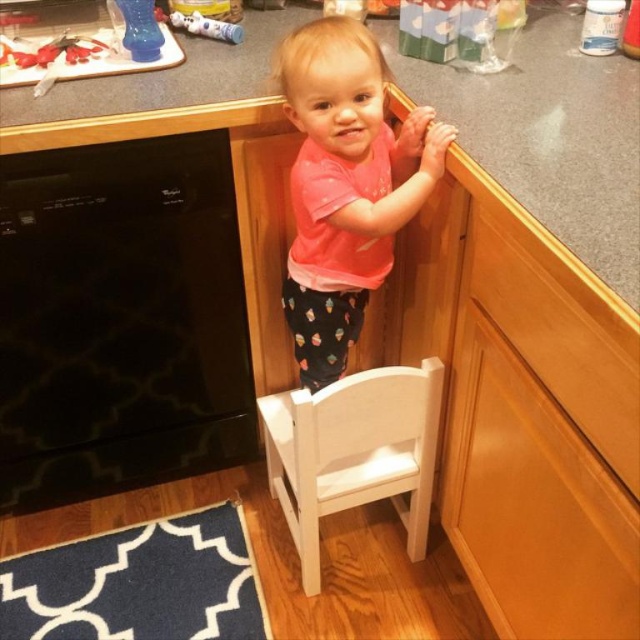
Question: From the image, what is the correct spatial relationship of black glossy oven at left in relation to wooden drawer at upper right?

Choices:
 (A) below
 (B) above

Answer: (A)

Question: Which of the following is the closest to the observer?

Choices:
 (A) (390, 234)
 (B) (177, 24)

Answer: (A)

Question: Is pink matte shirt at center further to camera compared to wooden drawer at upper right?

Choices:
 (A) no
 (B) yes

Answer: (B)

Question: Which object is closer to the camera taking this photo?

Choices:
 (A) wooden drawer at upper right
 (B) white wooden chair at lower center

Answer: (A)

Question: Can you confirm if gray matte counter top at upper center is bigger than white wooden chair at lower center?

Choices:
 (A) yes
 (B) no

Answer: (A)

Question: Estimate the real-world distances between objects in this image. Which object is farther from the wooden drawer at upper right?

Choices:
 (A) black glossy oven at left
 (B) white wooden chair at lower center

Answer: (A)